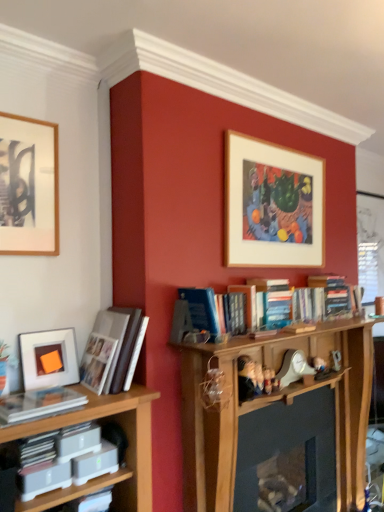
Question: Does point (107, 368) appear closer or farther from the camera than point (296, 351)?

Choices:
 (A) farther
 (B) closer

Answer: (B)

Question: In terms of height, does white glossy photo album at left, the 1th book in the back-to-front sequence, look taller or shorter compared to white plastic toy at center?

Choices:
 (A) short
 (B) tall

Answer: (B)

Question: Considering the real-world distances, which object is farthest from the clear plastic book at lower left, arranged as the second book when viewed from the back?

Choices:
 (A) wooden picture frame at upper left, which appears as the 2th picture frame when viewed from the front
 (B) wooden picture frame at upper center, acting as the 3th picture frame starting from the front
 (C) white plastic toy at center
 (D) white glossy photo album at left, positioned as the first book in top-to-bottom order
 (E) matte white paperback book at lower left

Answer: (B)

Question: Considering the real-world distances, which object is farthest from the matte white paperback book at lower left?

Choices:
 (A) clear plastic book at lower left, the first book from the bottom
 (B) wooden picture frame at upper center, the 1th picture frame in the right-to-left sequence
 (C) wooden picture frame at upper left, acting as the 3th picture frame starting from the right
 (D) white mesh screen at right
 (E) white glossy photo album at left, positioned as the first book in top-to-bottom order

Answer: (D)